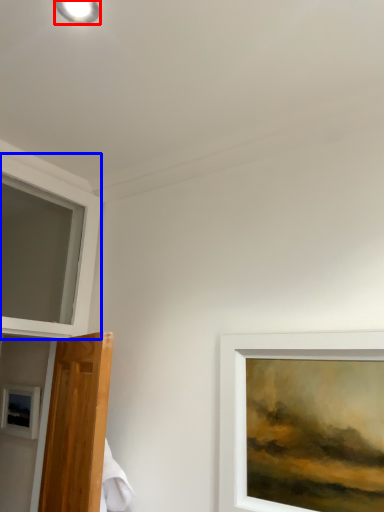
Question: Which point is further to the camera, droplight (highlighted by a red box) or window (highlighted by a blue box)?

Choices:
 (A) droplight
 (B) window

Answer: (B)